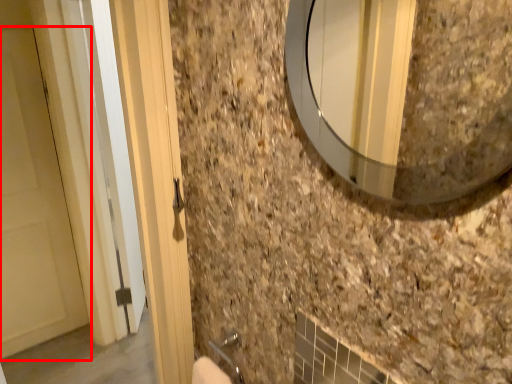
Question: In this image, where is door (annotated by the red box) located relative to mirror?

Choices:
 (A) left
 (B) right

Answer: (A)